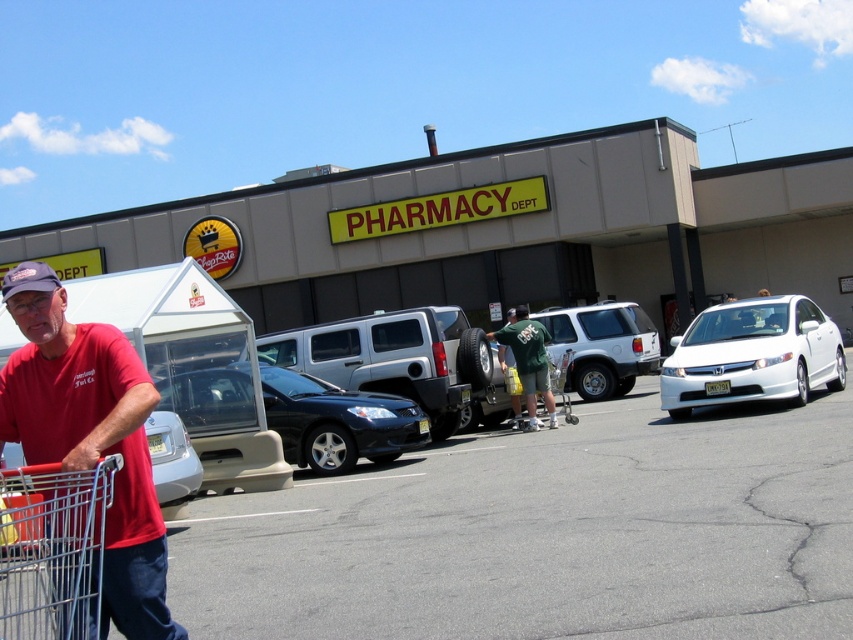
Question: Which point is farther to the camera?

Choices:
 (A) (514, 316)
 (B) (36, 364)

Answer: (A)

Question: Can you confirm if gray asphalt parking lot at center is bigger than metallic silver shopping cart at lower left?

Choices:
 (A) no
 (B) yes

Answer: (B)

Question: Does gray asphalt parking lot at center have a lesser width compared to shiny black sedan at center?

Choices:
 (A) no
 (B) yes

Answer: (A)

Question: Does metallic silver shopping cart at lower left appear on the left side of white glossy sedan at right?

Choices:
 (A) no
 (B) yes

Answer: (B)

Question: Which object is positioned closest to the white matte suv at center?

Choices:
 (A) white glossy sedan at right
 (B) gray asphalt parking lot at center

Answer: (A)

Question: Which object appears closest to the camera in this image?

Choices:
 (A) gray asphalt parking lot at center
 (B) metallic silver shopping cart at lower left
 (C) white matte suv at center
 (D) green fabric shirt at center

Answer: (B)